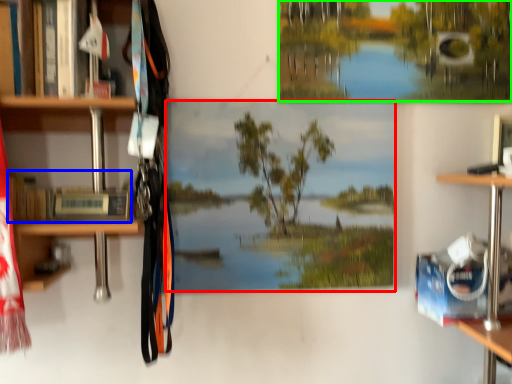
Question: Which is farther away from mural (highlighted by a red box)? book (highlighted by a blue box) or tree (highlighted by a green box)?

Choices:
 (A) book
 (B) tree

Answer: (A)